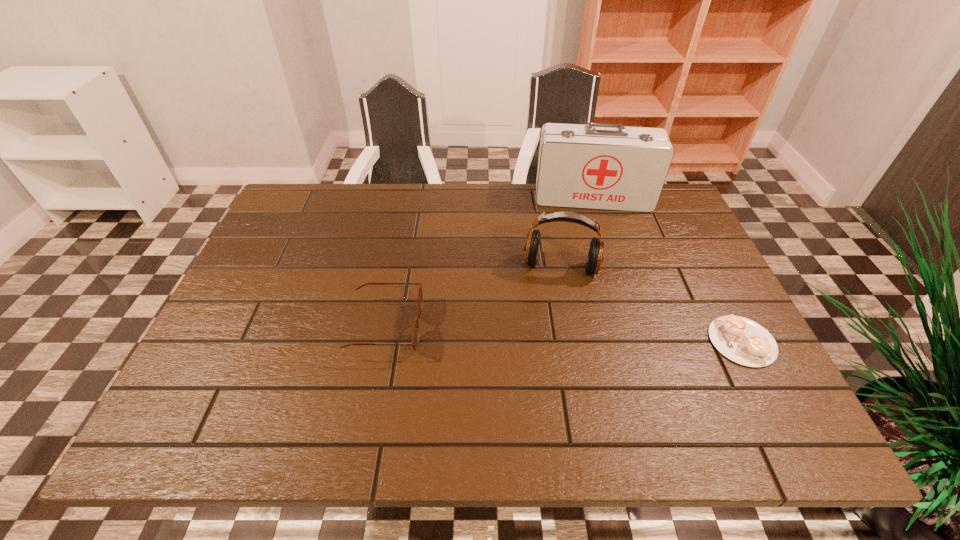
Identify the location of vacant space on the desktop that is between the spectacles and the shortest object and is positioned on the front-facing side of the first-aid kit. The image size is (960, 540). (612, 336).

Identify the location of free space on the desktop that is between the leftmost object and the shortest object and is positioned on the ear cups of the headset. (552, 334).